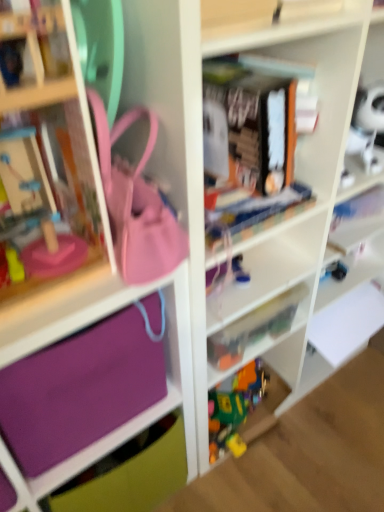
Question: Considering the relative sizes of translucent plastic toys at center and matte pink purse at center in the image provided, is translucent plastic toys at center thinner than matte pink purse at center?

Choices:
 (A) no
 (B) yes

Answer: (B)

Question: Is translucent plastic toys at center bigger than matte pink purse at center?

Choices:
 (A) yes
 (B) no

Answer: (B)

Question: Is translucent plastic toys at center positioned behind matte pink purse at center?

Choices:
 (A) no
 (B) yes

Answer: (B)

Question: Is translucent plastic toys at center not near matte pink purse at center?

Choices:
 (A) yes
 (B) no

Answer: (B)

Question: Are translucent plastic toys at center and matte pink purse at center beside each other?

Choices:
 (A) no
 (B) yes

Answer: (A)

Question: Is translucent plastic toys at center aimed at matte pink purse at center?

Choices:
 (A) no
 (B) yes

Answer: (A)

Question: From a real-world perspective, is purple fabric at lower left, placed as the first cabinet when sorted from left to right, below blue rubber toy at center?

Choices:
 (A) no
 (B) yes

Answer: (B)

Question: Does purple fabric at lower left, which appears as the second cabinet when viewed from the right, have a larger size compared to blue rubber toy at center?

Choices:
 (A) yes
 (B) no

Answer: (A)

Question: Are purple fabric at lower left, placed as the first cabinet when sorted from left to right, and blue rubber toy at center far apart?

Choices:
 (A) yes
 (B) no

Answer: (B)

Question: Does purple fabric at lower left, placed as the first cabinet when sorted from left to right, turn towards blue rubber toy at center?

Choices:
 (A) no
 (B) yes

Answer: (A)

Question: Is purple fabric at lower left, placed as the first cabinet when sorted from left to right, positioned in front of blue rubber toy at center?

Choices:
 (A) no
 (B) yes

Answer: (B)

Question: Is purple fabric at lower left, placed as the first cabinet when sorted from left to right, turned away from blue rubber toy at center?

Choices:
 (A) no
 (B) yes

Answer: (A)

Question: Is purple fabric bag at left, which is the 2th cabinet from left to right, facing towards matte pink purse at center?

Choices:
 (A) no
 (B) yes

Answer: (A)